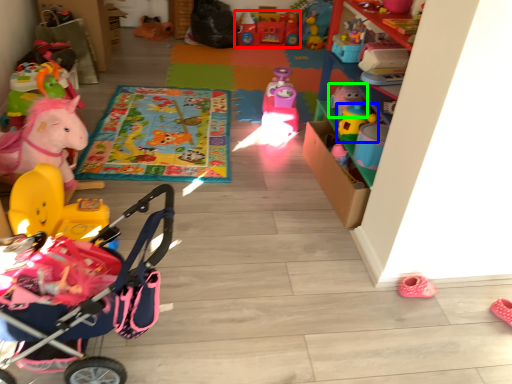
Question: Which is farther away from toy (highlighted by a red box)? toy (highlighted by a blue box) or toy (highlighted by a green box)?

Choices:
 (A) toy
 (B) toy

Answer: (A)